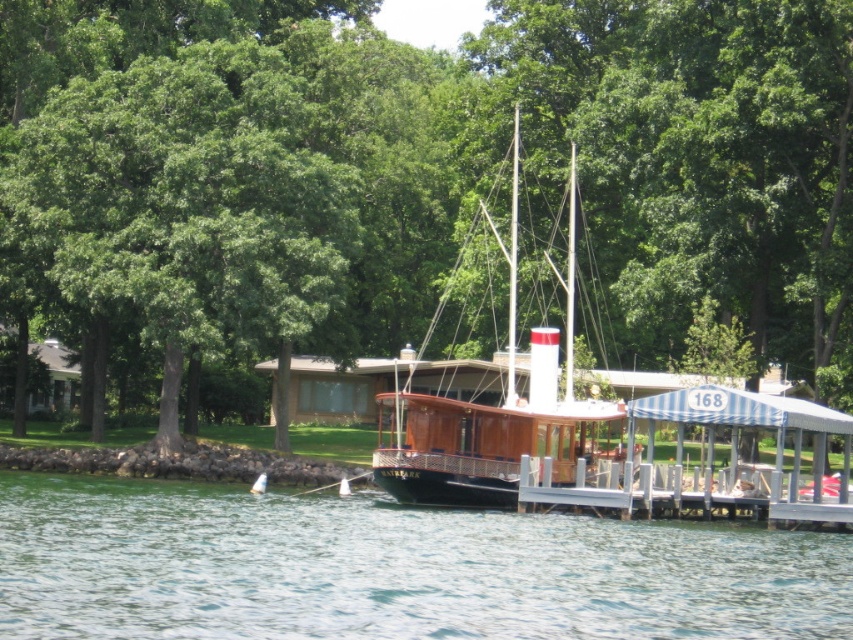
You are standing at the edge of the lake and want to take a photo of the green leafy tree at center. Where should you position yourself to capture the tree in the frame?

The green leafy tree at center is located at point (421,186), so you should position yourself at the edge of the lake facing towards that coordinate to capture the tree in the frame.

You are planning to take a photo of the wooden boat at center and the clear water at center from the shore. Which object will appear larger in the photo?

The wooden boat at center will appear larger in the photo because it is larger than the clear water at center.